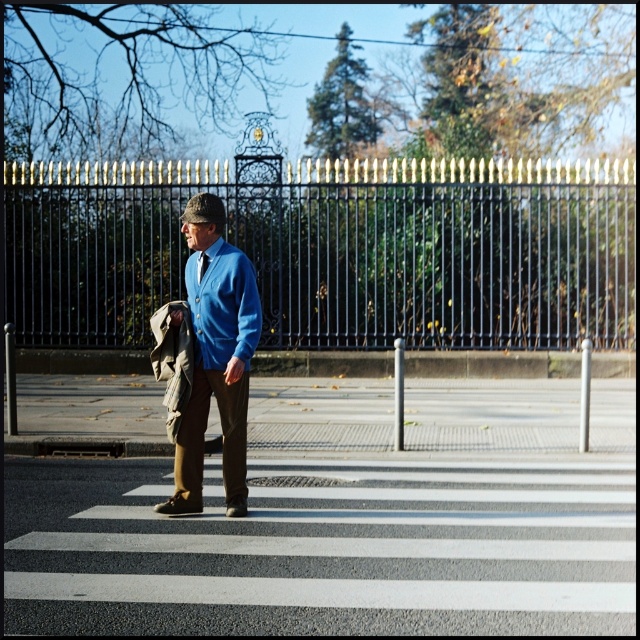
You are standing at the pedestrian crossing and want to take a photo of both point (x=230, y=476) and point (x=196, y=317) in the scene. Which point should you focus on first to ensure both are in clear view?

You should focus on point (x=230, y=476) first because it is closer to the camera than point (x=196, y=317). This ensures both points are in clear view as the depth of field will cover the farther point.

From the picture: You are a fashion designer observing a man in the scene. He is wearing a blue smooth dress shirt at center and a blue silk tie at center. Which item is positioned to the right side of the other?

The blue smooth dress shirt at center is to the right of the blue silk tie at center.